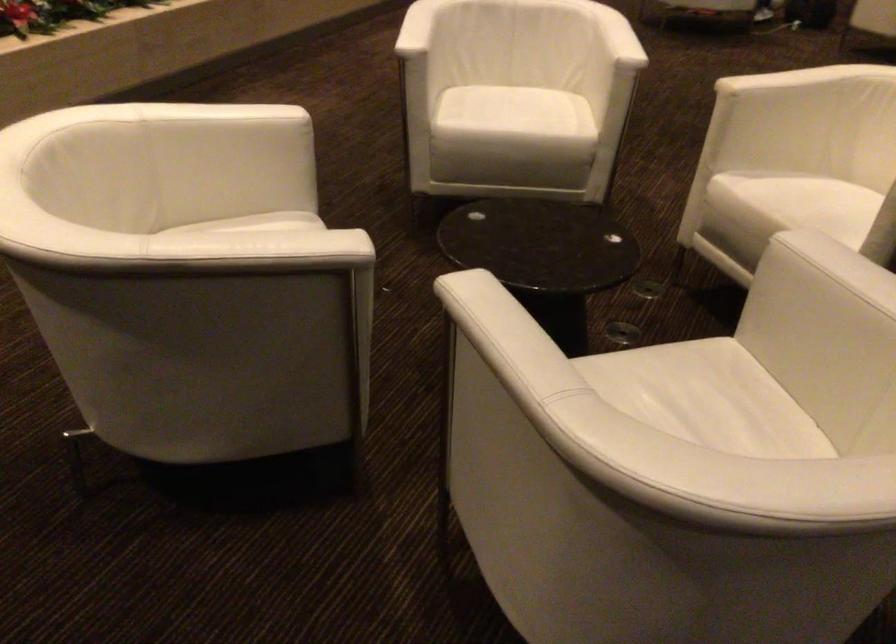
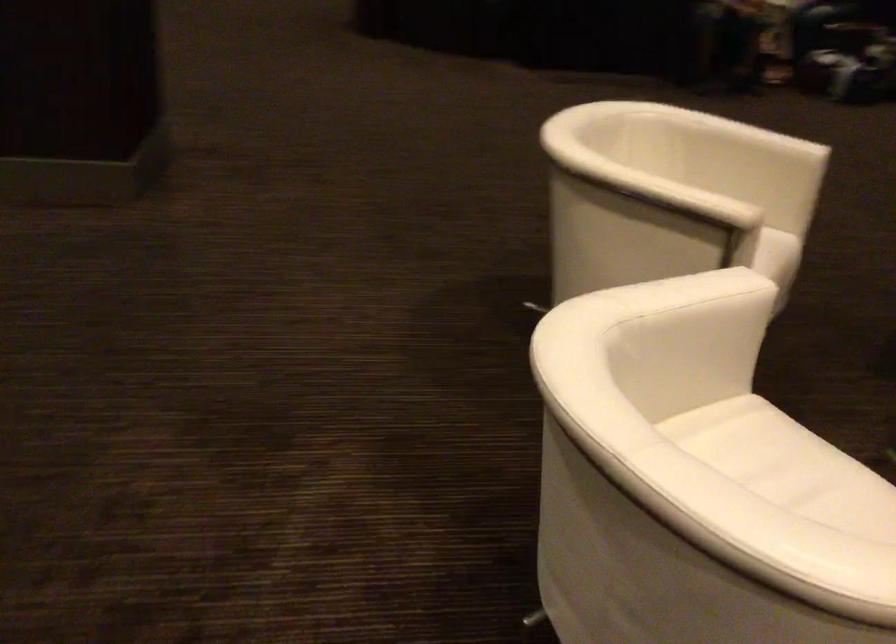
Find the pixel in the second image that matches the point at 737,128 in the first image.

(676, 261)